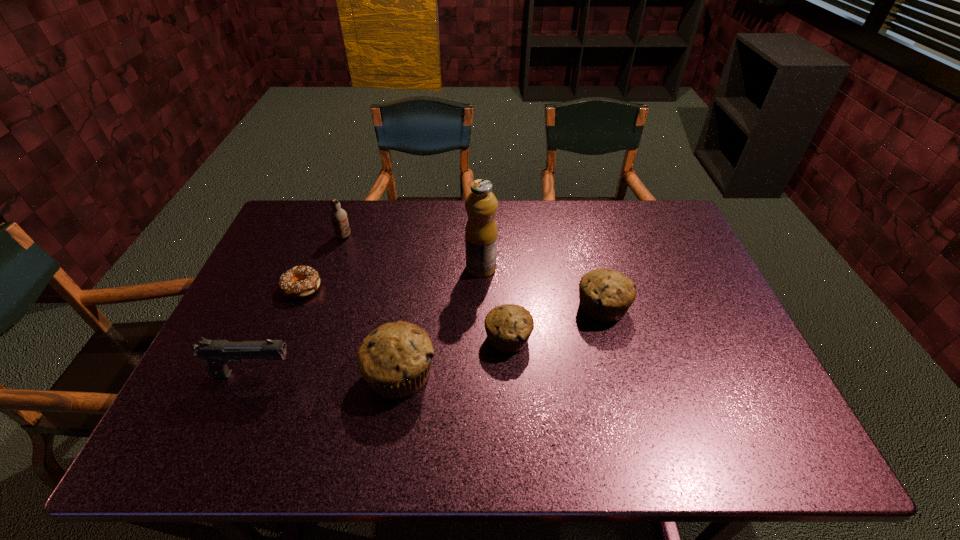
What are the coordinates of `vacant point located between the leftmost muffin and the farthest object` in the screenshot? It's located at (372, 305).

In order to click on vacant space in between the farthest object and the leftmost muffin in this screenshot , I will do `click(372, 305)`.

I want to click on free space between the fourth object from right to left and the sixth tallest object, so click(x=454, y=356).

Where is `vacant area that lies between the chocolate milk and the gun`? vacant area that lies between the chocolate milk and the gun is located at coordinates (299, 305).

This screenshot has height=540, width=960. I want to click on vacant region between the doughnut and the rightmost muffin, so click(452, 297).

I want to click on free space between the leftmost muffin and the doughnut, so click(350, 330).

Locate an element on the screen. the second closest object to the rightmost object is located at coordinates pyautogui.click(x=481, y=233).

Point out which object is positioned as the sixth nearest to the tallest object. Please provide its 2D coordinates. Your answer should be formatted as a tuple, i.e. [(x, y)], where the tuple contains the x and y coordinates of a point satisfying the conditions above.

[(217, 353)]

Where is `the second closest muffin to the sixth tallest object`? the second closest muffin to the sixth tallest object is located at coordinates (605, 295).

Find the location of `muffin that stands as the closest to the gun`. muffin that stands as the closest to the gun is located at coordinates (395, 359).